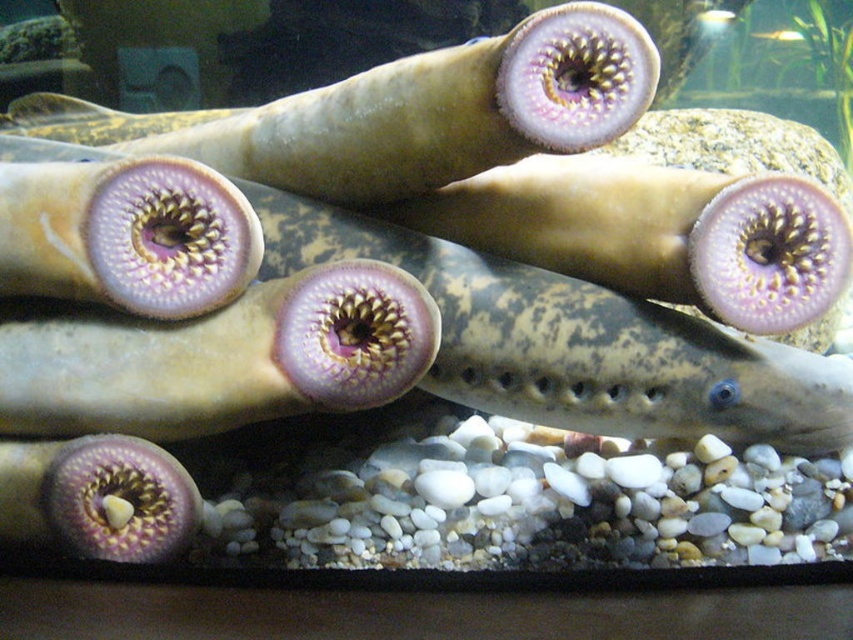
Can you confirm if pink matte/skinny fish at center is thinner than pinkish-purple smooth eel at upper center?

Correct, pink matte/skinny fish at center's width is less than pinkish-purple smooth eel at upper center's.

Image resolution: width=853 pixels, height=640 pixels. What do you see at coordinates (218, 356) in the screenshot? I see `pink matte/skinny fish at center` at bounding box center [218, 356].

Does point (288, 371) lie behind point (608, 67)?

No, it is in front of (608, 67).

I want to click on pink matte/skinny fish at center, so click(218, 356).

Who is shorter, smooth beige fish at center or pink matte/soft eel at center?

Standing shorter between the two is pink matte/soft eel at center.

Locate an element on the screen. smooth beige fish at center is located at coordinates (648, 230).

Does point (508, 192) come closer to viewer compared to point (10, 262)?

No, (508, 192) is behind (10, 262).

Where is `smooth beige fish at center`? The image size is (853, 640). smooth beige fish at center is located at coordinates (648, 230).

Between pinkish-purple smooth eel at upper center and pink matte/soft eel at center, which one is positioned lower?

pink matte/soft eel at center is below.

Does pinkish-purple smooth eel at upper center have a greater height compared to pink matte/soft eel at center?

Correct, pinkish-purple smooth eel at upper center is much taller as pink matte/soft eel at center.

Between point (254, 122) and point (169, 163), which one is positioned in front?

Positioned in front is point (169, 163).

I want to click on pinkish-purple smooth eel at upper center, so click(440, 112).